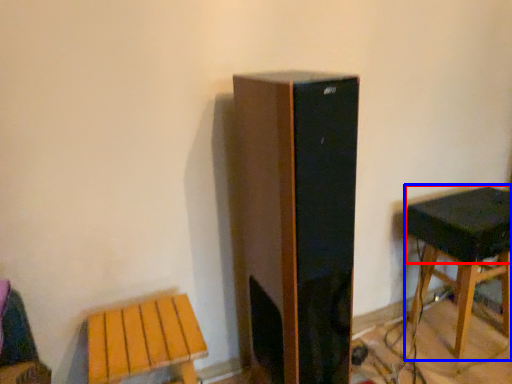
Question: Which object appears farthest to the camera in this image, speaker (highlighted by a red box) or stool (highlighted by a blue box)?

Choices:
 (A) speaker
 (B) stool

Answer: (B)